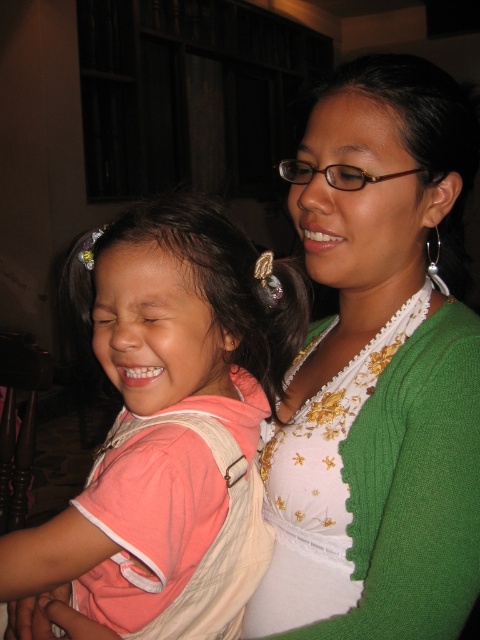
Question: From the image, what is the correct spatial relationship of green textured sweater at upper right in relation to pink fabric shirt at left?

Choices:
 (A) below
 (B) above

Answer: (B)

Question: Is green textured sweater at upper right to the right of pink fabric shirt at left from the viewer's perspective?

Choices:
 (A) no
 (B) yes

Answer: (B)

Question: Among these points, which one is nearest to the camera?

Choices:
 (A) (348, 294)
 (B) (291, 314)

Answer: (B)

Question: Does green textured sweater at upper right have a smaller size compared to pink fabric shirt at left?

Choices:
 (A) no
 (B) yes

Answer: (A)